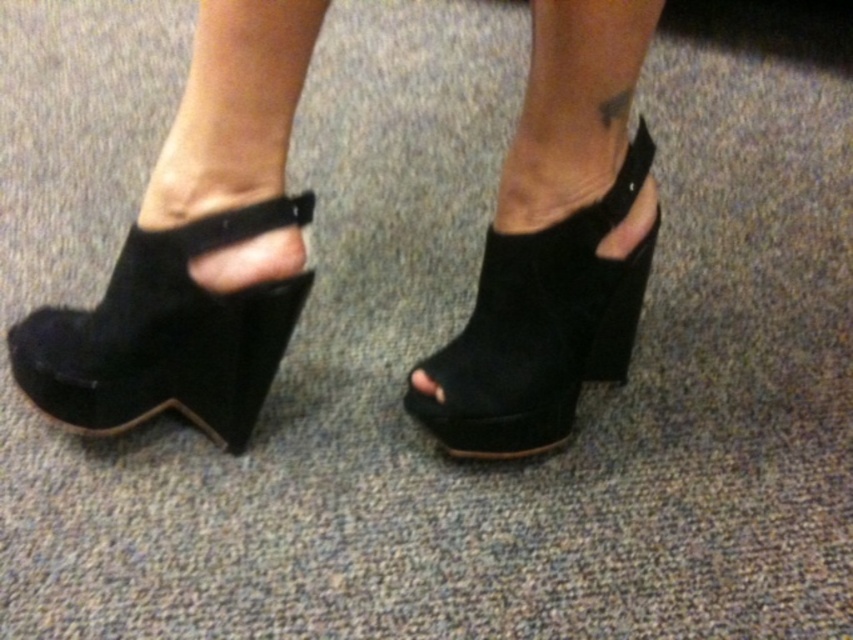
Question: Where is suede wedge shoes at center located in relation to suede black wedge at center in the image?

Choices:
 (A) above
 (B) below

Answer: (A)

Question: Can you confirm if suede black wedge at left is positioned below suede black wedge at center?

Choices:
 (A) yes
 (B) no

Answer: (A)

Question: Which of these objects is positioned closest to the suede black wedge at left?

Choices:
 (A) suede black wedge at center
 (B) black suede toe at center

Answer: (A)

Question: Is suede wedge shoes at center positioned behind suede black wedge at left?

Choices:
 (A) no
 (B) yes

Answer: (A)

Question: Estimate the real-world distances between objects in this image. Which object is closer to the suede black wedge at left?

Choices:
 (A) black suede toe at center
 (B) suede black wedge at center
 (C) suede wedge shoes at center

Answer: (C)

Question: Which object is the closest to the black suede toe at center?

Choices:
 (A) suede wedge shoes at center
 (B) suede black wedge at center

Answer: (B)